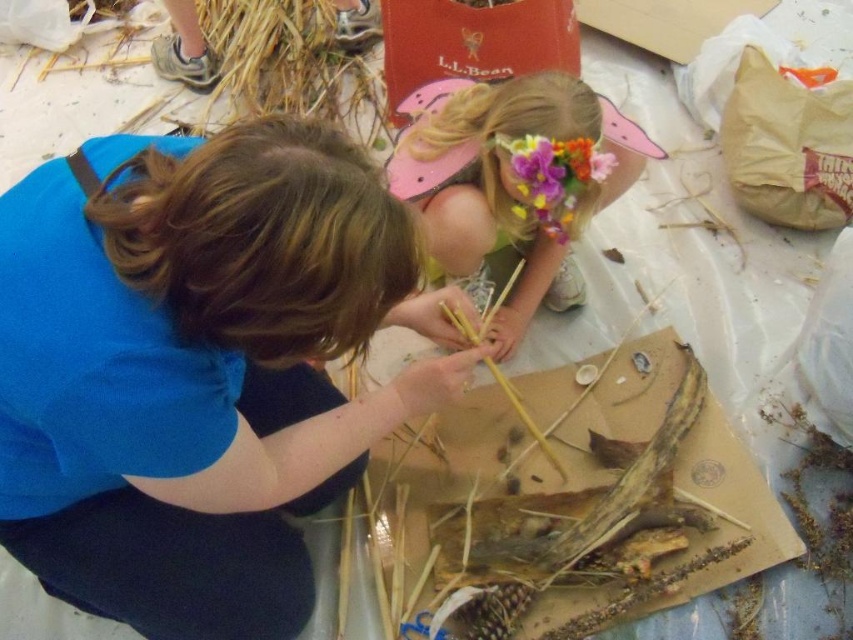
Can you confirm if blue fabric shirt at upper left is positioned to the right of brown cardboard at center?

In fact, blue fabric shirt at upper left is to the left of brown cardboard at center.

Does blue fabric shirt at upper left have a larger size compared to brown cardboard at center?

Indeed, blue fabric shirt at upper left has a larger size compared to brown cardboard at center.

The width and height of the screenshot is (853, 640). Describe the element at coordinates (196, 369) in the screenshot. I see `blue fabric shirt at upper left` at that location.

At what (x,y) coordinates should I click in order to perform the action: click on blue fabric shirt at upper left. Please return your answer as a coordinate pair (x, y). This screenshot has height=640, width=853. Looking at the image, I should click on (196, 369).

Does blue fabric shirt at upper left appear on the left side of floral paper crown at upper center?

Correct, you'll find blue fabric shirt at upper left to the left of floral paper crown at upper center.

Looking at this image, who is more distant from viewer, (4, 420) or (434, 125)?

The point (434, 125) is more distant.

Who is more distant from viewer, (x=268, y=540) or (x=457, y=232)?

Point (x=457, y=232)

At what (x,y) coordinates should I click in order to perform the action: click on blue fabric shirt at upper left. Please return your answer as a coordinate pair (x, y). The width and height of the screenshot is (853, 640). Looking at the image, I should click on (196, 369).

Who is positioned more to the left, blue fabric shirt at upper left or floral crown at upper center?

Positioned to the left is blue fabric shirt at upper left.

Is point (338, 170) less distant than point (550, 180)?

Yes, point (338, 170) is in front of point (550, 180).

I want to click on blue fabric shirt at upper left, so click(196, 369).